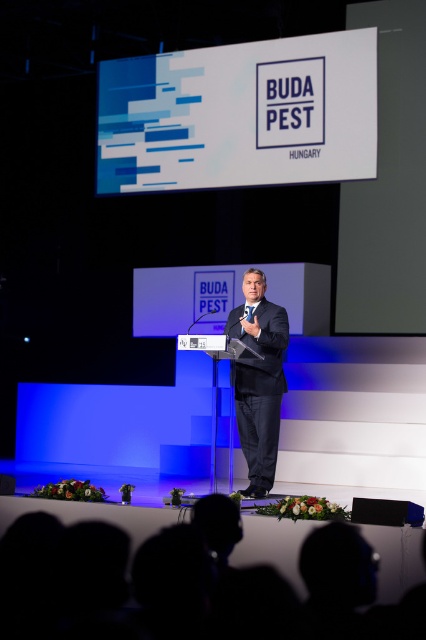
Between white matte sign at upper center and dark suit at center, which one has more height?

With more height is dark suit at center.

Is white matte sign at upper center smaller than dark suit at center?

No.

Who is more distant from viewer, (204, 131) or (284, 333)?

Point (204, 131)

Locate an element on the screen. white matte sign at upper center is located at coordinates (239, 115).